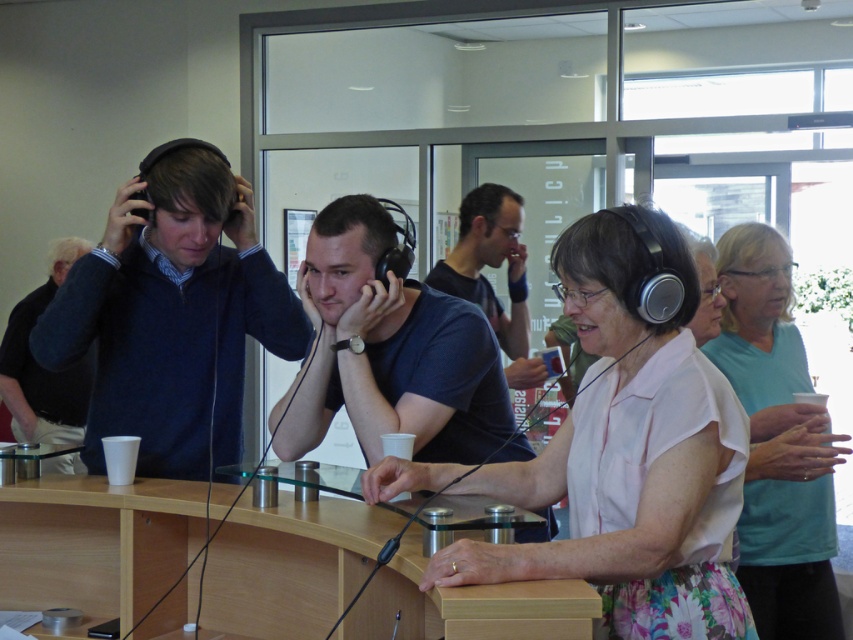
Measure the distance between matte black headphones at center and camera.

matte black headphones at center is 1.92 meters away from camera.

Does matte black headphones at center come behind white floral dress at center?

That is False.

Which is in front, point (474, 388) or point (718, 352)?

Point (474, 388) is in front.

Where is `matte black headphones at center`? matte black headphones at center is located at coordinates (390, 352).

Can you confirm if wooden table at center is smaller than white floral dress at center?

Actually, wooden table at center might be larger than white floral dress at center.

Consider the image. Which is above, wooden table at center or white floral dress at center?

white floral dress at center

Is point (173, 536) behind point (837, 602)?

No, it is in front of (837, 602).

This screenshot has width=853, height=640. I want to click on wooden table at center, so click(96, 544).

In the scene shown: Is dark blue sweater at left in front of matte blue shirt at center?

That is False.

Is dark blue sweater at left to the right of matte blue shirt at center from the viewer's perspective?

No, dark blue sweater at left is not to the right of matte blue shirt at center.

Which is in front, point (86, 388) or point (502, 195)?

Positioned in front is point (502, 195).

Where is `dark blue sweater at left`? This screenshot has height=640, width=853. dark blue sweater at left is located at coordinates (42, 368).